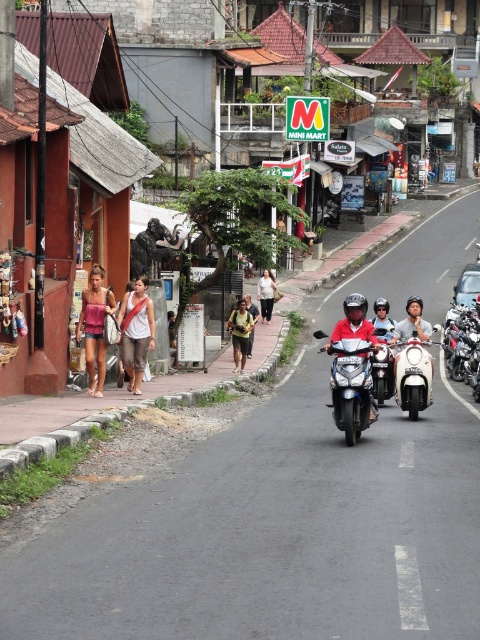
Measure the distance between point (135, 348) and camera.

Point (135, 348) is 63.03 feet away from camera.

Does white cotton tank top at center have a larger size compared to yellow fabric bag at center?

Yes.

Describe the element at coordinates (135, 332) in the screenshot. This screenshot has height=640, width=480. I see `white cotton tank top at center` at that location.

Find the location of `white cotton tank top at center`. white cotton tank top at center is located at coordinates (135, 332).

Is shiny silver motorcycle at center to the right of white glossy scooter at center from the viewer's perspective?

No, shiny silver motorcycle at center is not to the right of white glossy scooter at center.

Who is shorter, shiny silver motorcycle at center or white glossy scooter at center?

shiny silver motorcycle at center

The image size is (480, 640). I want to click on shiny silver motorcycle at center, so click(351, 387).

Image resolution: width=480 pixels, height=640 pixels. What are the coordinates of `shiny silver motorcycle at center` in the screenshot? It's located at (351, 387).

Where is `white glossy scooter at center`? This screenshot has width=480, height=640. white glossy scooter at center is located at coordinates (x=412, y=374).

Can you confirm if white glossy scooter at center is smaller than white cotton shirt at center?

No, white glossy scooter at center is not smaller than white cotton shirt at center.

Which is in front, point (428, 401) or point (263, 317)?

Point (428, 401) is more forward.

Locate an element on the screen. white glossy scooter at center is located at coordinates (412, 374).